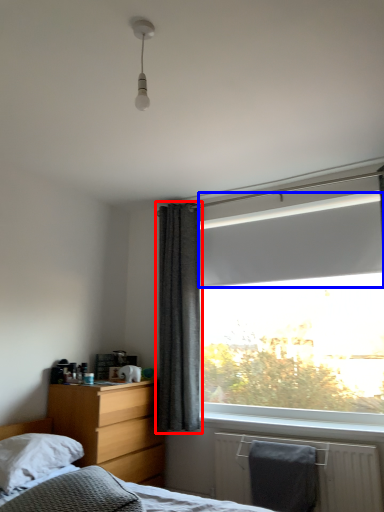
Question: Among these objects, which one is farthest to the camera, curtain (highlighted by a red box) or window screen (highlighted by a blue box)?

Choices:
 (A) curtain
 (B) window screen

Answer: (A)